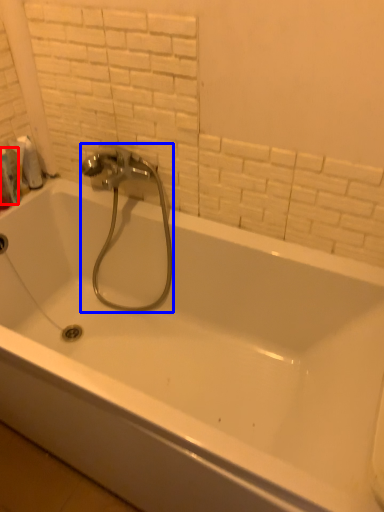
Question: Which of the following is the farthest to the observer, toiletry (highlighted by a red box) or plumbing fixture (highlighted by a blue box)?

Choices:
 (A) toiletry
 (B) plumbing fixture

Answer: (A)